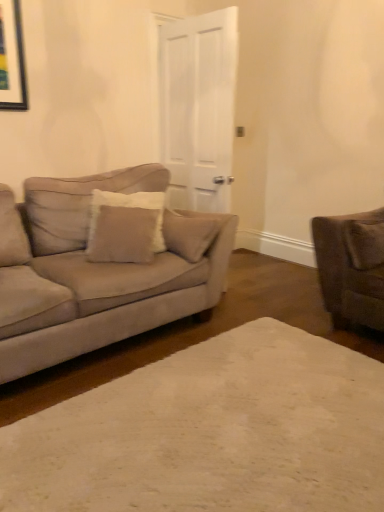
Question: Is suede-like brown pillow at right, positioned as the 1th pillow in right-to-left order, with white matte door at center?

Choices:
 (A) no
 (B) yes

Answer: (A)

Question: Is white matte door at center surrounded by suede-like brown pillow at right, positioned as the 1th pillow in right-to-left order?

Choices:
 (A) yes
 (B) no

Answer: (B)

Question: Is suede-like brown pillow at right, positioned as the 1th pillow in right-to-left order, further to camera compared to white matte door at center?

Choices:
 (A) no
 (B) yes

Answer: (A)

Question: Can you confirm if suede-like brown pillow at right, acting as the second pillow starting from the left, is shorter than white matte door at center?

Choices:
 (A) yes
 (B) no

Answer: (A)

Question: Is suede-like brown pillow at right, positioned as the 1th pillow in right-to-left order, turned away from white matte door at center?

Choices:
 (A) yes
 (B) no

Answer: (A)

Question: From a real-world perspective, is suede-like brown pillow at right, positioned as the 1th pillow in right-to-left order, on top of white matte door at center?

Choices:
 (A) yes
 (B) no

Answer: (B)

Question: Is beige fabric pillow at center, the 2th pillow in the right-to-left sequence, directly adjacent to white matte door at center?

Choices:
 (A) yes
 (B) no

Answer: (B)

Question: Considering the relative positions of beige fabric pillow at center, placed as the first pillow when sorted from left to right, and white matte door at center in the image provided, is beige fabric pillow at center, placed as the first pillow when sorted from left to right, to the left of white matte door at center from the viewer's perspective?

Choices:
 (A) no
 (B) yes

Answer: (B)

Question: Is beige fabric pillow at center, placed as the first pillow when sorted from left to right, looking in the opposite direction of white matte door at center?

Choices:
 (A) yes
 (B) no

Answer: (A)

Question: Does beige fabric pillow at center, placed as the first pillow when sorted from left to right, have a greater height compared to white matte door at center?

Choices:
 (A) yes
 (B) no

Answer: (B)

Question: From the image's perspective, is beige fabric pillow at center, placed as the first pillow when sorted from left to right, located above white matte door at center?

Choices:
 (A) no
 (B) yes

Answer: (A)

Question: Could white matte door at center be considered to be inside beige fabric pillow at center, the 2th pillow in the right-to-left sequence?

Choices:
 (A) yes
 (B) no

Answer: (B)

Question: Is beige carpet at center not close to suede-like brown pillow at right, positioned as the 1th pillow in right-to-left order?

Choices:
 (A) yes
 (B) no

Answer: (A)